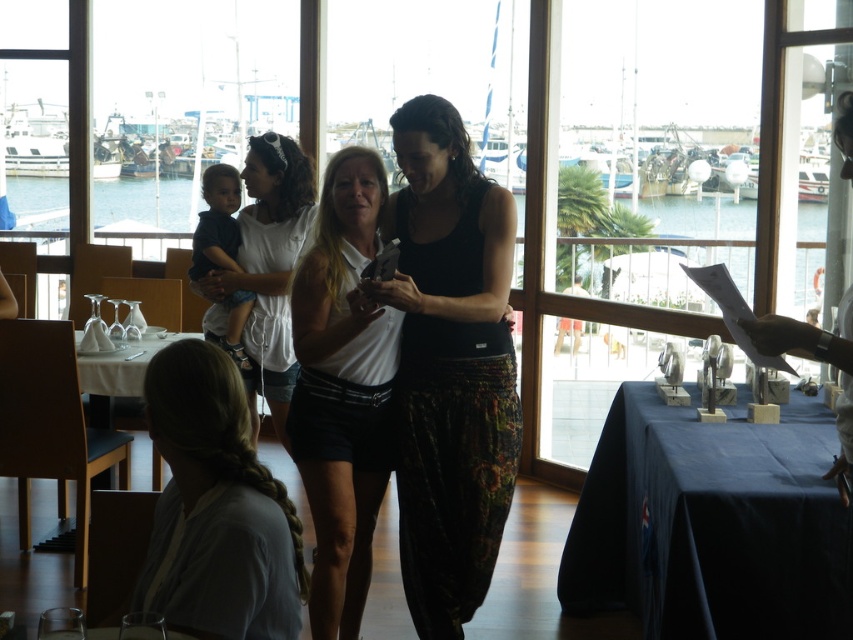
Question: Considering the real-world distances, which object is farthest from the black matte tank top at center?

Choices:
 (A) white cotton shirt at center
 (B) light gray cotton shirt at lower left
 (C) white matte shorts at center
 (D) dark blue fabric baby at center

Answer: (D)

Question: Which object is closer to the camera taking this photo?

Choices:
 (A) light gray cotton shirt at lower left
 (B) white matte shorts at center
 (C) white cotton shirt at center

Answer: (A)

Question: Which point is farther from the camera taking this photo?

Choices:
 (A) (200, 557)
 (B) (180, 333)

Answer: (B)

Question: Is blue fabric table at lower right thinner than black matte tank top at center?

Choices:
 (A) yes
 (B) no

Answer: (B)

Question: Is black matte tank top at center bigger than white matte shorts at center?

Choices:
 (A) no
 (B) yes

Answer: (B)

Question: Is light gray cotton shirt at lower left above white cloth at lower left?

Choices:
 (A) no
 (B) yes

Answer: (A)